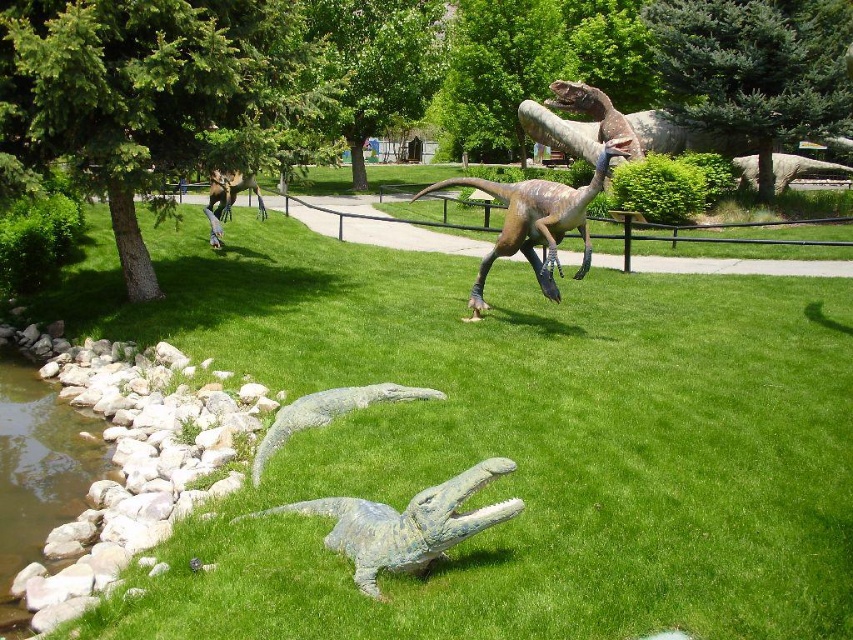
Question: Which object is the closest to the green stone statue at lower center?

Choices:
 (A) shiny metallic dinosaur at upper left
 (B) shiny metallic dinosaur at center
 (C) green patina stone crocodile at center

Answer: (C)

Question: Which object appears farthest from the camera in this image?

Choices:
 (A) green grass at lower left
 (B) green patina stone crocodile at center

Answer: (B)

Question: In this image, where is smooth rock creek at lower left located relative to shiny metallic dinosaur at upper left?

Choices:
 (A) below
 (B) above

Answer: (A)

Question: Is green stone statue at lower center bigger than shiny brown dinosaur at upper center?

Choices:
 (A) yes
 (B) no

Answer: (B)

Question: Which object is farther from the camera taking this photo?

Choices:
 (A) shiny brown dinosaur at upper center
 (B) green stone statue at lower center

Answer: (A)

Question: Is shiny brown dinosaur at upper center positioned in front of shiny metallic dinosaur at upper left?

Choices:
 (A) no
 (B) yes

Answer: (A)